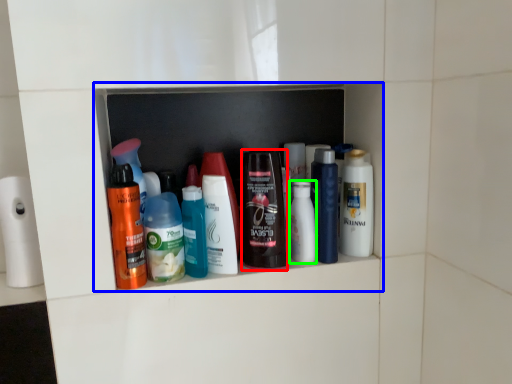
Question: Which is farther away from toiletry (highlighted by a red box)? shelf (highlighted by a blue box) or toiletry (highlighted by a green box)?

Choices:
 (A) shelf
 (B) toiletry

Answer: (A)